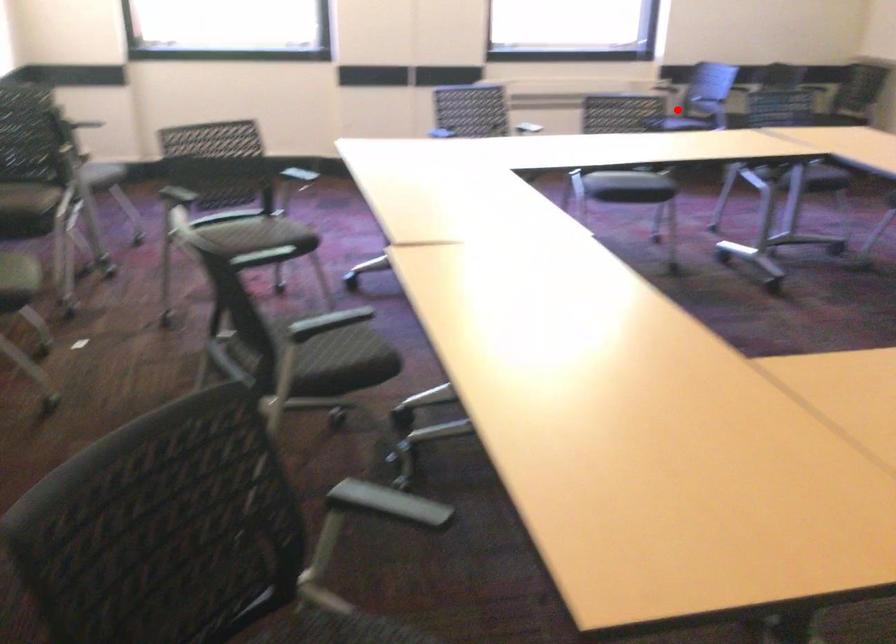
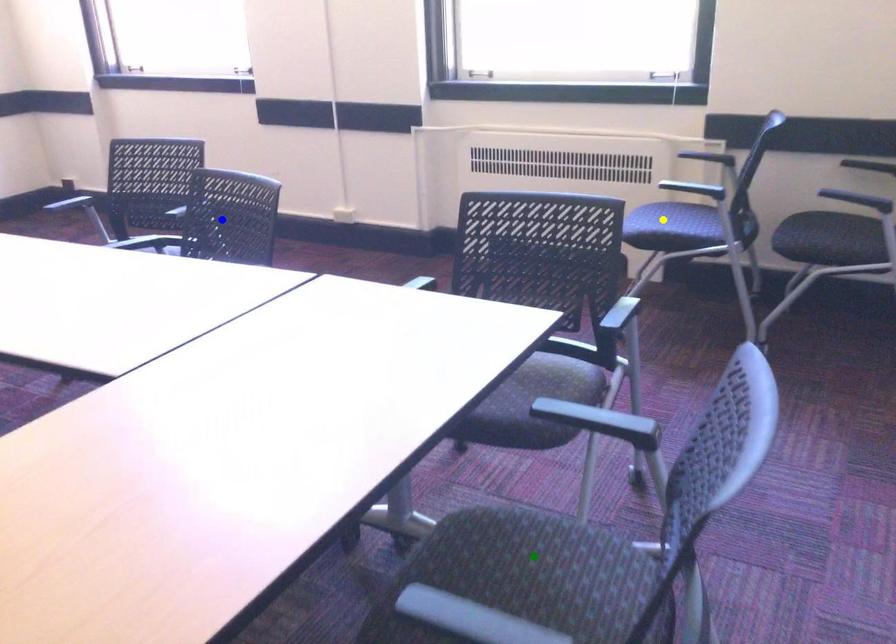
Question: I am providing you with two images of the same scene from different viewpoints. A red point is marked on the first image. You are given multiple points on the second image. Which mark in image 2 goes with the point in image 1?

Choices:
 (A) yellow point
 (B) blue point
 (C) green point

Answer: (A)